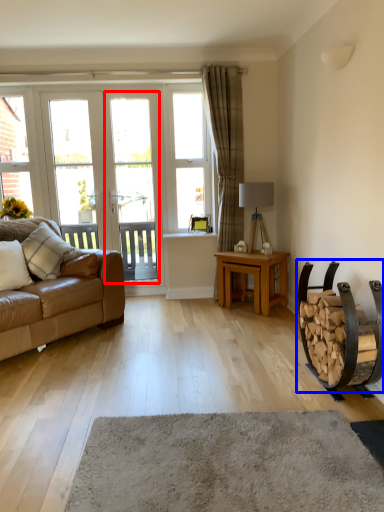
Question: Among these objects, which one is nearest to the camera, screen door (highlighted by a red box) or armchair (highlighted by a blue box)?

Choices:
 (A) screen door
 (B) armchair

Answer: (B)